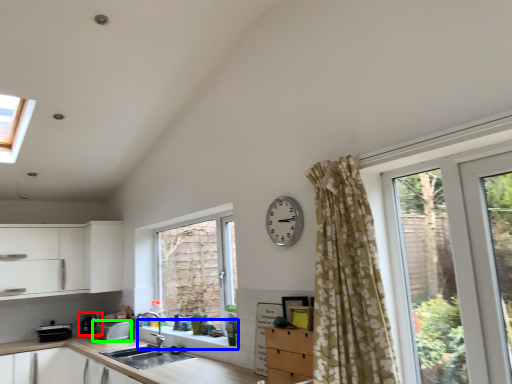
Question: Which is nearer to the appliance (highlighted by a red box)? window sill (highlighted by a blue box) or appliance (highlighted by a green box).

Choices:
 (A) window sill
 (B) appliance

Answer: (B)